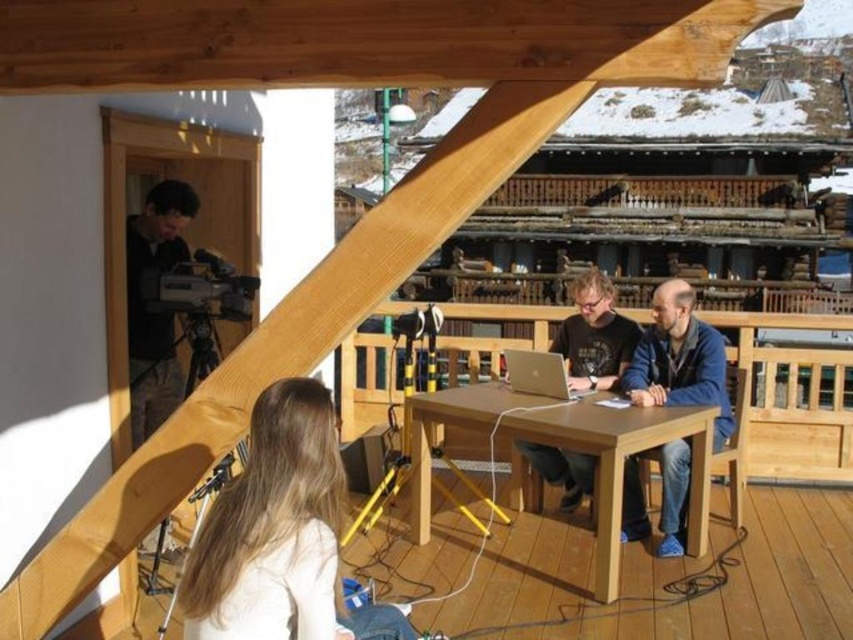
Is the position of light brown wooden table at center less distant than that of blue denim jeans at lower right?

Yes, it is in front of blue denim jeans at lower right.

Does light brown wooden table at center have a greater height compared to blue denim jeans at lower right?

Correct, light brown wooden table at center is much taller as blue denim jeans at lower right.

Which is behind, point (613, 499) or point (711, 336)?

Point (711, 336)

The width and height of the screenshot is (853, 640). In order to click on light brown wooden table at center in this screenshot , I will do `click(567, 449)`.

Is blue denim jeans at lower right behind matte black shirt at center?

No, blue denim jeans at lower right is closer to the viewer.

Is point (641, 368) more distant than point (593, 467)?

Yes, point (641, 368) is farther from viewer.

Which is in front, point (714, 404) or point (636, 340)?

Point (714, 404)

Identify the location of blue denim jeans at lower right. (680, 360).

Looking at this image, can you confirm if light brown hair at lower center is positioned to the right of matte black shirt at center?

Incorrect, light brown hair at lower center is not on the right side of matte black shirt at center.

Which is in front, point (370, 611) or point (579, 276)?

Point (370, 611)

This screenshot has height=640, width=853. I want to click on light brown hair at lower center, so click(x=279, y=534).